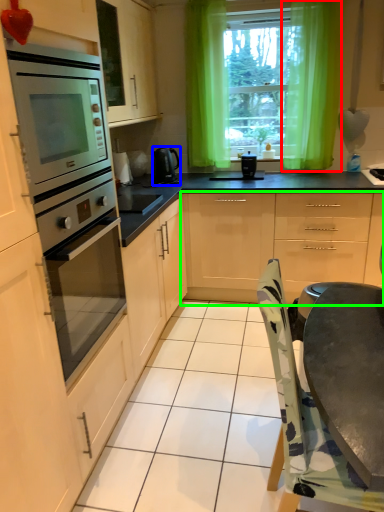
Question: Considering the real-world distances, which object is closest to curtain (highlighted by a red box)? home appliance (highlighted by a blue box) or cabinetry (highlighted by a green box).

Choices:
 (A) home appliance
 (B) cabinetry

Answer: (B)